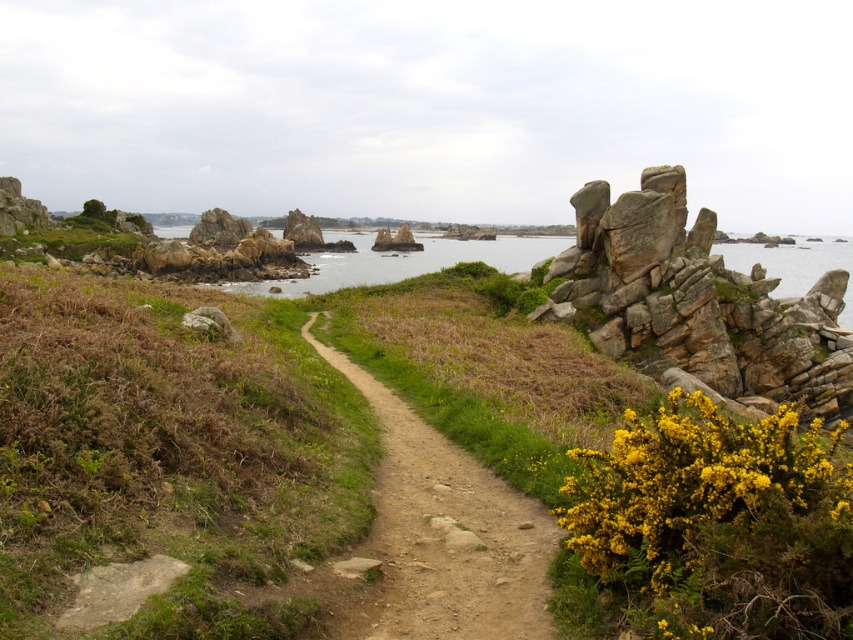
The width and height of the screenshot is (853, 640). Find the location of `dirt path at center`. dirt path at center is located at coordinates (442, 536).

From the picture: How much distance is there between dirt path at center and transparent water at upper right?

dirt path at center is 484.10 feet away from transparent water at upper right.

Is point (461, 493) positioned before point (744, 243)?

Yes, it is in front of point (744, 243).

Where is `dirt path at center`? dirt path at center is located at coordinates (442, 536).

Which of these two, dirt path at center or clear blue water at center, stands shorter?

dirt path at center is shorter.

Does dirt path at center appear over clear blue water at center?

No, dirt path at center is not above clear blue water at center.

Does point (387, 611) come farther from viewer compared to point (457, 257)?

No, (387, 611) is in front of (457, 257).

I want to click on dirt path at center, so click(x=442, y=536).

Does rockymaterial/texture at right have a lesser width compared to transparent water at upper right?

Indeed, rockymaterial/texture at right has a lesser width compared to transparent water at upper right.

Between rockymaterial/texture at right and transparent water at upper right, which one has more height?

transparent water at upper right is taller.

Which is behind, point (759, 372) or point (786, 256)?

The point (786, 256) is more distant.

At what (x,y) coordinates should I click in order to perform the action: click on rockymaterial/texture at right. Please return your answer as a coordinate pair (x, y). Looking at the image, I should click on (698, 301).